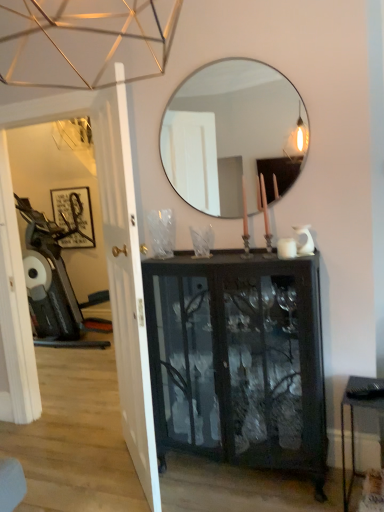
The width and height of the screenshot is (384, 512). In order to click on free point to the left of black glass cabinet at center in this screenshot , I will do `click(121, 480)`.